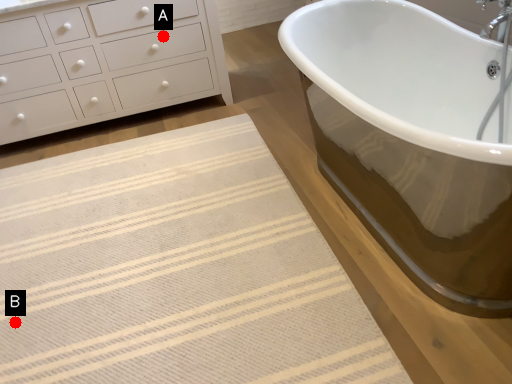
Question: Two points are circled on the image, labeled by A and B beside each circle. Which point is closer to the camera taking this photo?

Choices:
 (A) A is closer
 (B) B is closer

Answer: (B)